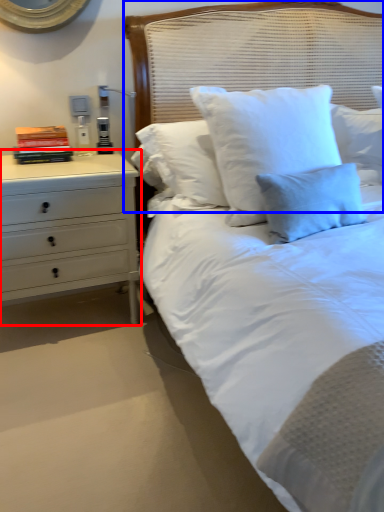
Question: Which object is closer to the camera taking this photo, chest of drawers (highlighted by a red box) or headboard (highlighted by a blue box)?

Choices:
 (A) chest of drawers
 (B) headboard

Answer: (B)